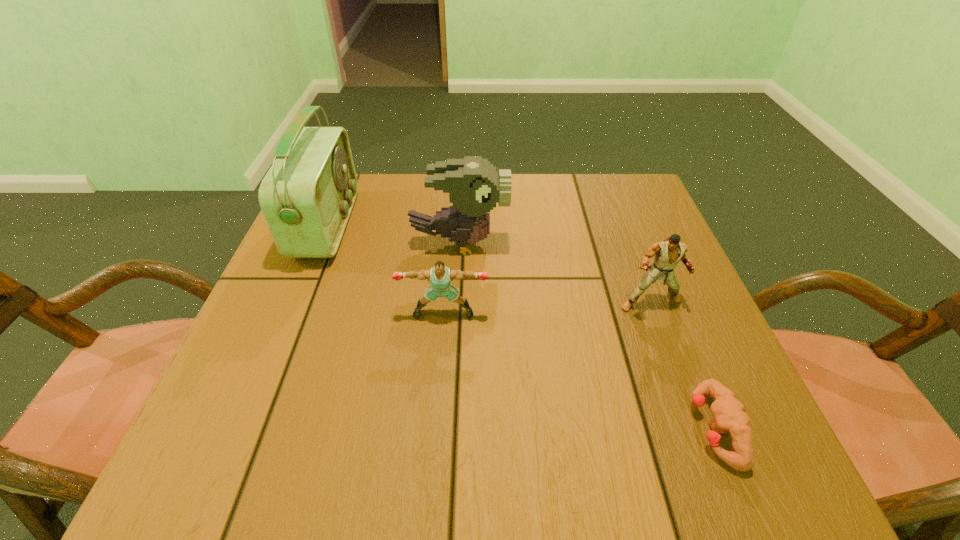
Locate an element on the screen. This screenshot has height=540, width=960. free region located on the front-facing side of the third shortest object is located at coordinates (669, 353).

Image resolution: width=960 pixels, height=540 pixels. I want to click on free space located 0.050m on the front-facing side of the leftmost puncher, so click(x=442, y=342).

I want to click on vacant area situated with the gloves of the shortest puncher facing forward, so click(x=558, y=428).

This screenshot has height=540, width=960. I want to click on free spot located with the gloves of the shortest puncher facing forward, so click(442, 428).

The width and height of the screenshot is (960, 540). I want to click on blank space located 0.250m with the gloves of the shortest puncher facing forward, so 532,428.

This screenshot has width=960, height=540. I want to click on object at the far edge, so click(x=307, y=196).

What are the coordinates of `object that is at the near edge` in the screenshot? It's located at pyautogui.click(x=728, y=413).

You are a GUI agent. You are given a task and a screenshot of the screen. Output one action in this format:
    pyautogui.click(x=<x>, y=<y>)
    Task: Click on the object that is at the left edge
    The width and height of the screenshot is (960, 540).
    Given the screenshot: What is the action you would take?
    pyautogui.click(x=307, y=196)

This screenshot has width=960, height=540. What are the coordinates of `object situated at the far left corner` in the screenshot? It's located at (307, 196).

You are a GUI agent. You are given a task and a screenshot of the screen. Output one action in this format:
    pyautogui.click(x=<x>, y=<y>)
    Task: Click on the object that is positioned at the near right corner
    
    Given the screenshot: What is the action you would take?
    pyautogui.click(x=728, y=413)